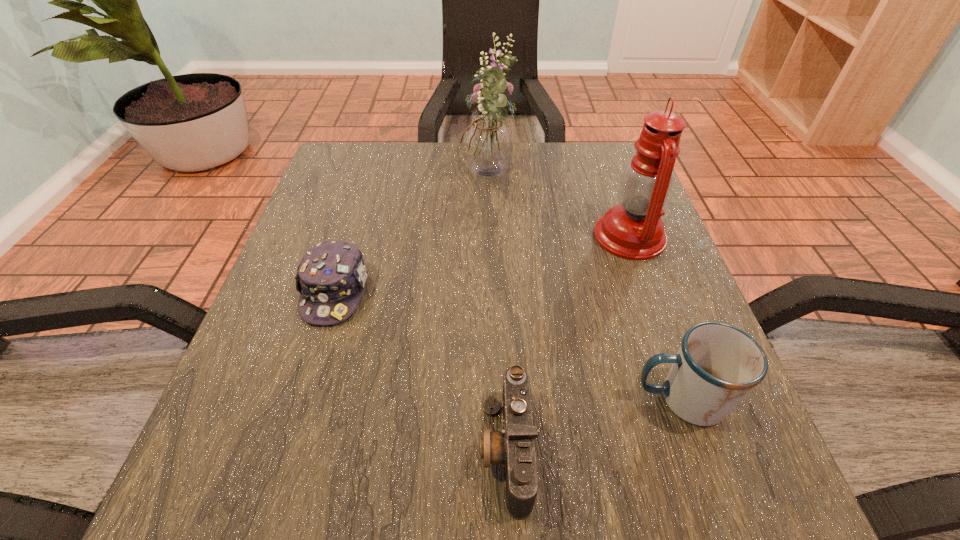
At what (x,y) coordinates should I click in order to perform the action: click on empty space between the bouquet and the leftmost object. Please return your answer as a coordinate pair (x, y). Looking at the image, I should click on (412, 235).

The width and height of the screenshot is (960, 540). Find the location of `vacant area between the camera and the third shortest object`. vacant area between the camera and the third shortest object is located at coordinates (594, 424).

Locate an element on the screen. The height and width of the screenshot is (540, 960). free space between the camera and the oil lamp is located at coordinates (568, 343).

Locate an element on the screen. free space that is in between the camera and the third shortest object is located at coordinates (594, 424).

Image resolution: width=960 pixels, height=540 pixels. In order to click on vacant area between the camera and the farthest object in this screenshot , I will do `click(497, 314)`.

What are the coordinates of `free space between the leftmost object and the oil lamp` in the screenshot? It's located at (483, 264).

Where is `vacant area that lies between the oil lamp and the camera`? Image resolution: width=960 pixels, height=540 pixels. vacant area that lies between the oil lamp and the camera is located at coordinates [x=568, y=343].

What are the coordinates of `vacant region between the camera and the farthest object` in the screenshot? It's located at (497, 314).

Locate an element on the screen. This screenshot has height=540, width=960. blank region between the mug and the bouquet is located at coordinates (585, 289).

Locate an element on the screen. the closest object to the oil lamp is located at coordinates (487, 143).